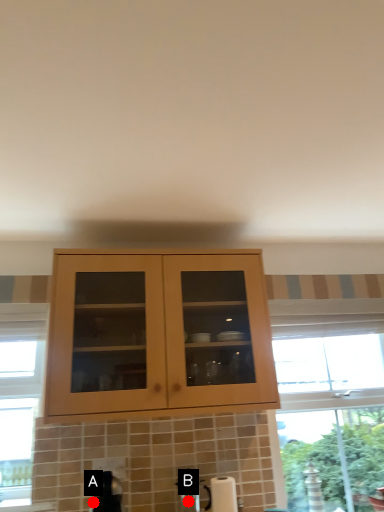
Question: Two points are circled on the image, labeled by A and B beside each circle. Which point is farther to the camera?

Choices:
 (A) A is further
 (B) B is further

Answer: (B)